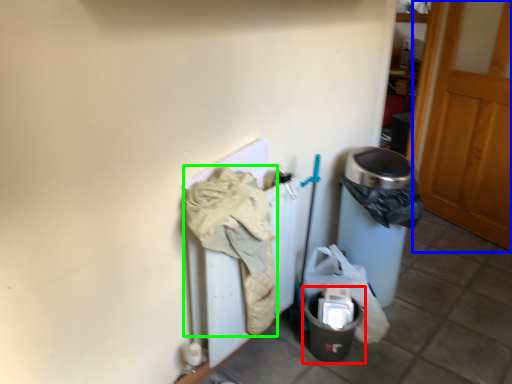
Question: Which object is the farthest from recycling bin (highlighted by a red box)? Choose among these: door (highlighted by a blue box) or clothing (highlighted by a green box).

Choices:
 (A) door
 (B) clothing

Answer: (A)